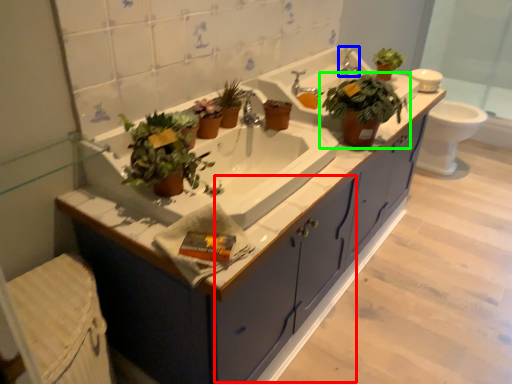
Question: Which is farther away from drawer (highlighted by a red box)? faucet (highlighted by a blue box) or houseplant (highlighted by a green box)?

Choices:
 (A) faucet
 (B) houseplant

Answer: (A)